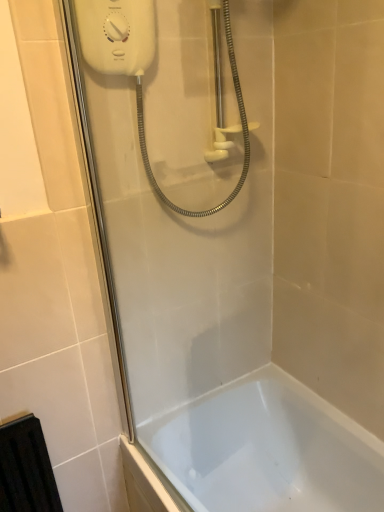
The image size is (384, 512). What do you see at coordinates (143, 66) in the screenshot?
I see `white plastic shower at upper center` at bounding box center [143, 66].

What do you see at coordinates (179, 187) in the screenshot? I see `white glossy shower door at upper left` at bounding box center [179, 187].

The image size is (384, 512). In order to click on white plastic shower at upper center in this screenshot , I will do `click(143, 66)`.

Which object is thinner, white glossy shower door at upper left or white glossy bathtub at lower center?

Thinner between the two is white glossy shower door at upper left.

From a real-world perspective, who is located higher, white glossy shower door at upper left or white glossy bathtub at lower center?

In real-world perspective, white glossy shower door at upper left is above.

From the image's perspective, is white glossy shower door at upper left above or below white glossy bathtub at lower center?

From the image's perspective, white glossy shower door at upper left appears above white glossy bathtub at lower center.

Considering the relative positions of white plastic shower at upper center and white glossy shower door at upper left in the image provided, is white plastic shower at upper center to the left of white glossy shower door at upper left from the viewer's perspective?

No.

Does white plastic shower at upper center lie behind white glossy shower door at upper left?

Yes, white plastic shower at upper center is behind white glossy shower door at upper left.

Between white plastic shower at upper center and white glossy shower door at upper left, which one has smaller size?

With smaller size is white glossy shower door at upper left.

From a real-world perspective, who is located lower, white plastic shower at upper center or white glossy shower door at upper left?

In real-world perspective, white glossy shower door at upper left is lower.

Is white glossy shower door at upper left at the back of white glossy bathtub at lower center?

white glossy bathtub at lower center is not turned away from white glossy shower door at upper left.

From the picture: Which is correct: white glossy bathtub at lower center is inside white glossy shower door at upper left, or outside of it?

The correct answer is: outside.

Who is more distant, white glossy bathtub at lower center or white glossy shower door at upper left?

Positioned behind is white glossy bathtub at lower center.

Can you confirm if white glossy bathtub at lower center is bigger than white glossy shower door at upper left?

Correct, white glossy bathtub at lower center is larger in size than white glossy shower door at upper left.

Does white glossy bathtub at lower center have a lesser height compared to white plastic shower at upper center?

Correct, white glossy bathtub at lower center is not as tall as white plastic shower at upper center.

Is white glossy bathtub at lower center not inside white plastic shower at upper center?

white glossy bathtub at lower center is positioned outside white plastic shower at upper center.

Is point (284, 445) farther from viewer compared to point (132, 42)?

Yes.

Does white glossy bathtub at lower center lie in front of white plastic shower at upper center?

No, it is not.

Is white glossy shower door at upper left next to white plastic shower at upper center?

They are not placed beside each other.

How much distance is there between white glossy shower door at upper left and white plastic shower at upper center?

A distance of 6.66 inches exists between white glossy shower door at upper left and white plastic shower at upper center.

Is white glossy shower door at upper left wider or thinner than white plastic shower at upper center?

Considering their sizes, white glossy shower door at upper left looks slimmer than white plastic shower at upper center.

Considering the sizes of white glossy shower door at upper left and white plastic shower at upper center in the image, is white glossy shower door at upper left taller or shorter than white plastic shower at upper center?

In the image, white glossy shower door at upper left appears to be taller than white plastic shower at upper center.

From the picture: From the image's perspective, is white plastic shower at upper center positioned above or below white glossy bathtub at lower center?

white plastic shower at upper center is situated higher than white glossy bathtub at lower center in the image.

From the picture: Does white plastic shower at upper center have a greater height compared to white glossy bathtub at lower center?

Yes.

Is white plastic shower at upper center facing away from white glossy bathtub at lower center?

No, white plastic shower at upper center is not facing away from white glossy bathtub at lower center.

From a real-world perspective, is white plastic shower at upper center below white glossy bathtub at lower center?

No.

Image resolution: width=384 pixels, height=512 pixels. Identify the location of bathtub below the white glossy shower door at upper left (from a real-world perspective). (256, 452).

Where is `shower door located in front of the white plastic shower at upper center`? This screenshot has width=384, height=512. shower door located in front of the white plastic shower at upper center is located at coordinates (179, 187).

Based on the photo, from the image, which object appears to be farther from white plastic shower at upper center, white glossy bathtub at lower center or white glossy shower door at upper left?

white glossy bathtub at lower center is further to white plastic shower at upper center.

Based on their spatial positions, is white plastic shower at upper center or white glossy shower door at upper left further from white glossy bathtub at lower center?

white plastic shower at upper center lies further to white glossy bathtub at lower center than the other object.

Looking at the image, which one is located closer to white glossy shower door at upper left, white plastic shower at upper center or white glossy bathtub at lower center?

The object closer to white glossy shower door at upper left is white plastic shower at upper center.

Which object lies nearer to the anchor point white glossy bathtub at lower center, white glossy shower door at upper left or white plastic shower at upper center?

The object closer to white glossy bathtub at lower center is white glossy shower door at upper left.

Considering their positions, is white glossy bathtub at lower center positioned further to white glossy shower door at upper left than white plastic shower at upper center?

white glossy bathtub at lower center is further to white glossy shower door at upper left.

When comparing their distances from white plastic shower at upper center, does white glossy shower door at upper left or white glossy bathtub at lower center seem further?

white glossy bathtub at lower center is positioned further to the anchor white plastic shower at upper center.

At what (x,y) coordinates should I click in order to perform the action: click on shower door between white plastic shower at upper center and white glossy bathtub at lower center from top to bottom. Please return your answer as a coordinate pair (x, y). Image resolution: width=384 pixels, height=512 pixels. Looking at the image, I should click on (179, 187).